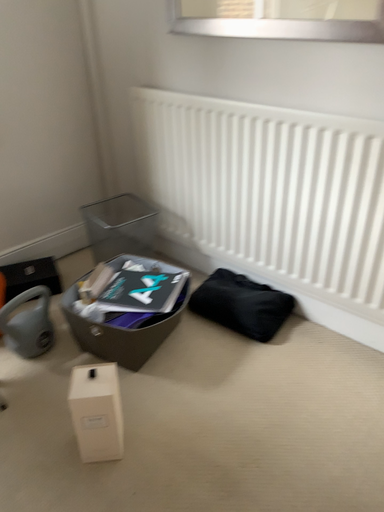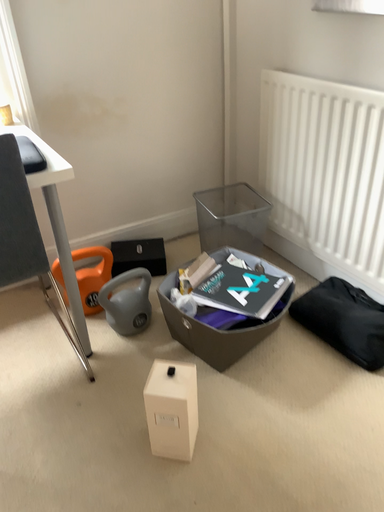
Question: How did the camera likely rotate when shooting the video?

Choices:
 (A) rotated right
 (B) rotated left

Answer: (B)